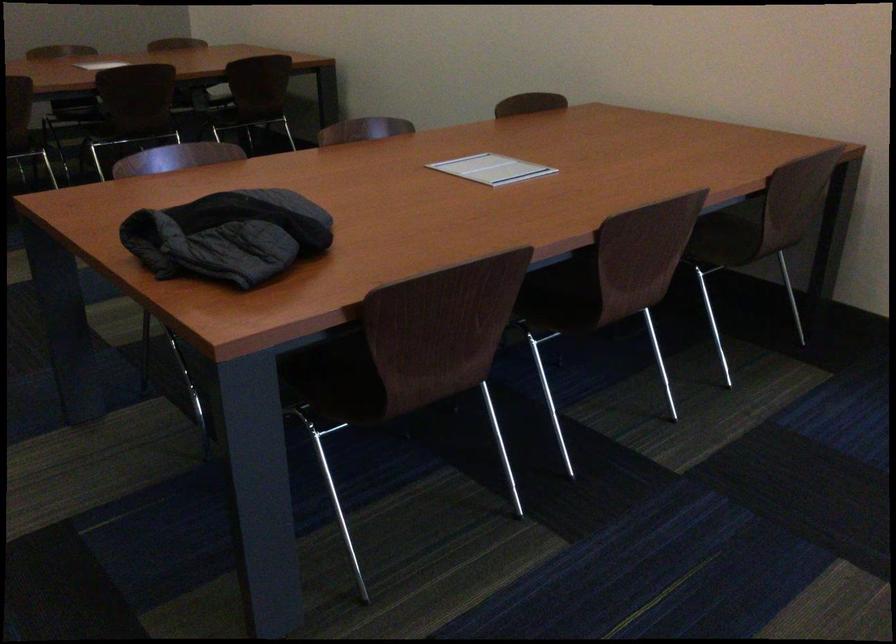
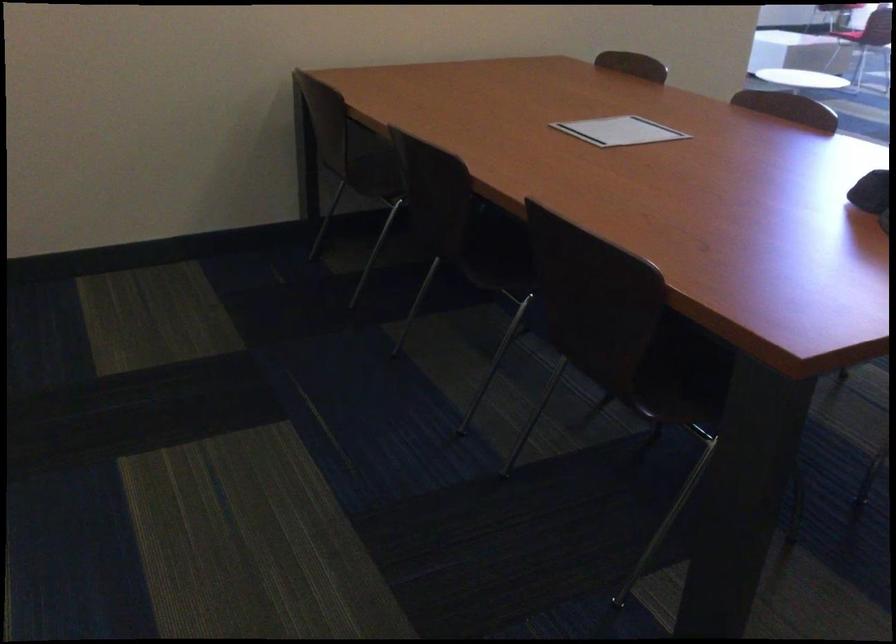
Question: I am providing you with two images of the same scene from different viewpoints. Which of the following objects are not visible in image2?

Choices:
 (A) black ladder handle
 (B) brown chair sitting surface
 (C) chair sitting surface
 (D) white paper document

Answer: (C)